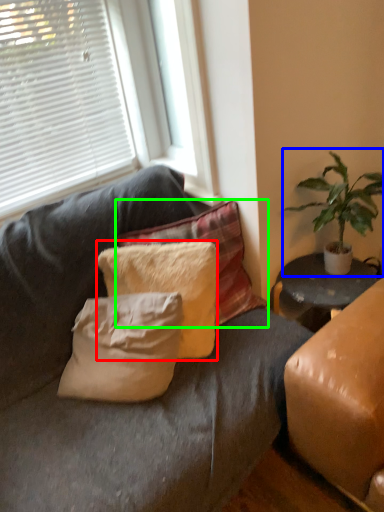
Question: Which object is positioned farthest from pillow (highlighted by a red box)? Select from houseplant (highlighted by a blue box) and pillow (highlighted by a green box).

Choices:
 (A) houseplant
 (B) pillow

Answer: (A)